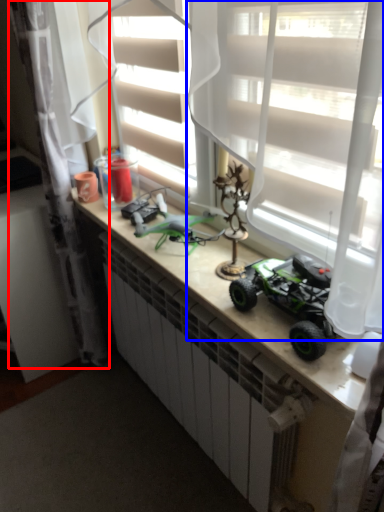
Question: Which object is further to the camera taking this photo, curtain (highlighted by a red box) or curtain (highlighted by a blue box)?

Choices:
 (A) curtain
 (B) curtain

Answer: (A)